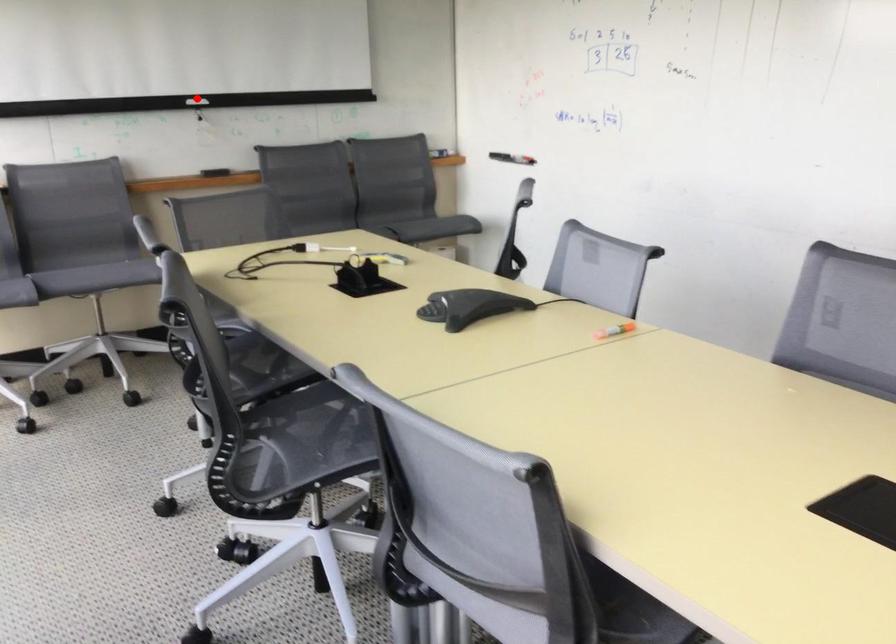
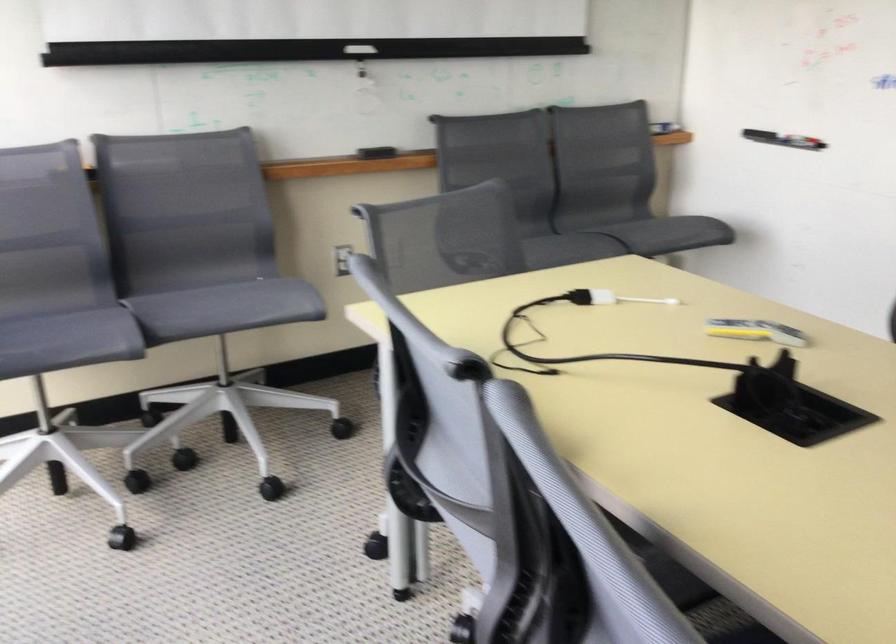
Question: I am providing you with two images of the same scene from different viewpoints. A red point is shown in image1. For the corresponding object point in image2, is it positioned nearer or farther from the camera?

Choices:
 (A) Nearer
 (B) Farther

Answer: (A)